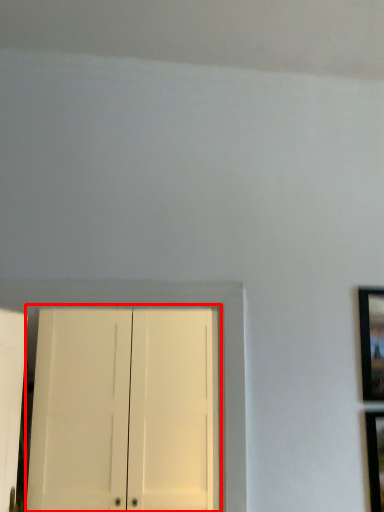
Question: Observing the image, what is the correct spatial positioning of door (annotated by the red box) in reference to picture frame?

Choices:
 (A) left
 (B) right

Answer: (A)